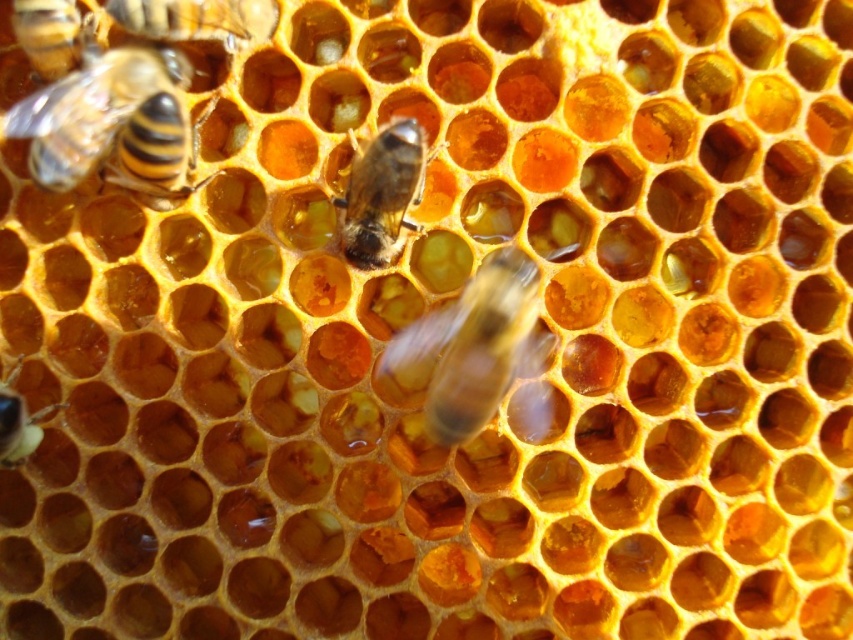
Question: Is translucent amber bee at center to the left of yellow-black striped bee at upper left from the viewer's perspective?

Choices:
 (A) yes
 (B) no

Answer: (B)

Question: Which of the following is the farthest from the observer?

Choices:
 (A) (3, 396)
 (B) (350, 230)
 (C) (74, 104)
 (D) (61, 51)

Answer: (A)

Question: Does yellow-black striped bee at upper left appear over translucent yellowish honeycomb at bottom left?

Choices:
 (A) yes
 (B) no

Answer: (A)

Question: Which point is closer to the camera?

Choices:
 (A) translucent yellowish honeycomb at upper left
 (B) yellow-brown translucent bee at upper left

Answer: (B)

Question: Considering the real-world distances, which object is closest to the translucent yellowish honeycomb at upper left?

Choices:
 (A) yellow-brown translucent bee at upper left
 (B) translucent amber bee at center

Answer: (A)

Question: Does translucent amber bee at center appear on the right side of translucent yellowish honeycomb at upper left?

Choices:
 (A) no
 (B) yes

Answer: (B)